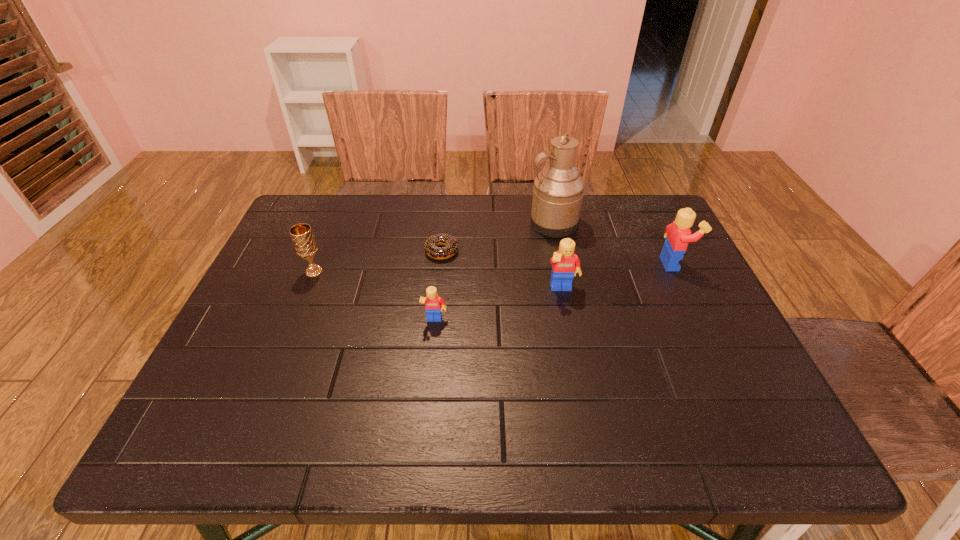
At what (x,y) coordinates should I click in order to perform the action: click on vacant space positioned 0.080m on the face of the nearest Lego. Please return your answer as a coordinate pair (x, y). This screenshot has height=540, width=960. Looking at the image, I should click on (431, 356).

You are a GUI agent. You are given a task and a screenshot of the screen. Output one action in this format:
    pyautogui.click(x=<x>, y=<y>)
    Task: Click on the free space located 0.090m on the face of the second shortest Lego
    This screenshot has width=960, height=540.
    Given the screenshot: What is the action you would take?
    pyautogui.click(x=569, y=327)

In order to click on vacant point located 0.170m on the left of the tallest object in this screenshot , I will do `click(471, 223)`.

The image size is (960, 540). I want to click on free spot located 0.120m on the back of the doughnut, so click(445, 217).

The width and height of the screenshot is (960, 540). What are the coordinates of `vacant area located on the back of the chalice` in the screenshot? It's located at (343, 201).

This screenshot has height=540, width=960. I want to click on pitcher present at the far edge, so [x=558, y=190].

Locate an element on the screen. The width and height of the screenshot is (960, 540). doughnut situated at the far edge is located at coordinates (451, 246).

This screenshot has width=960, height=540. I want to click on object that is positioned at the left edge, so click(304, 243).

Where is `object that is positioned at the right edge`? The height and width of the screenshot is (540, 960). object that is positioned at the right edge is located at coordinates (678, 234).

Locate an element on the screen. The height and width of the screenshot is (540, 960). free space at the far edge of the desktop is located at coordinates (378, 216).